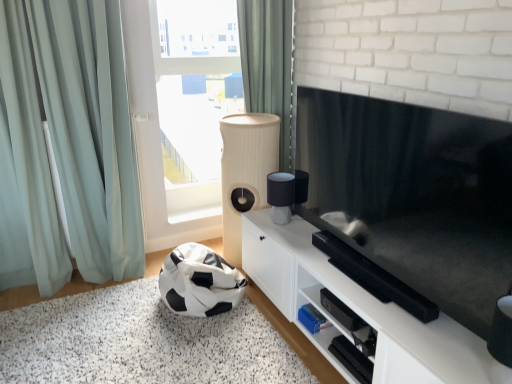
Find the location of a particular element. empty space that is ontop of white matte cabinet at center is located at coordinates (312, 251).